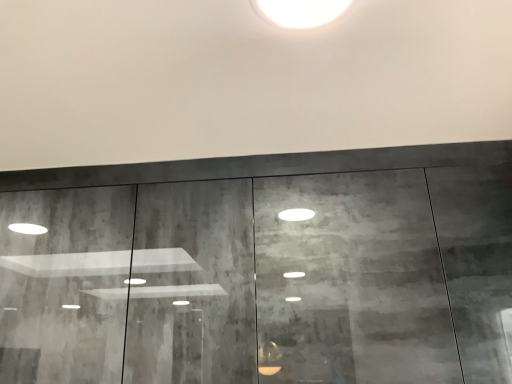
Describe the element at coordinates (273, 167) in the screenshot. I see `textured concrete door at center` at that location.

Locate an element on the screen. The image size is (512, 384). textured concrete door at center is located at coordinates point(273,167).

This screenshot has width=512, height=384. What are the coordinates of `white glossy light at upper center` in the screenshot? It's located at (302, 11).

What do you see at coordinates (302, 11) in the screenshot? I see `white glossy light at upper center` at bounding box center [302, 11].

Find the location of a particular element. Image resolution: width=512 pixels, height=384 pixels. textured concrete door at center is located at coordinates (273, 167).

Which object is positioned more to the left, textured concrete door at center or white glossy light at upper center?

textured concrete door at center is more to the left.

Considering the relative positions of textured concrete door at center and white glossy light at upper center in the image provided, is textured concrete door at center in front of white glossy light at upper center?

No, it is not.

Which is further, (426, 151) or (279, 20)?

A: The point (426, 151) is farther from the camera.

From the image's perspective, who appears lower, textured concrete door at center or white glossy light at upper center?

From the image's view, textured concrete door at center is below.

From a real-world perspective, is textured concrete door at center physically located above or below white glossy light at upper center?

In terms of real-world spatial position, textured concrete door at center is below white glossy light at upper center.

Is textured concrete door at center wider or thinner than white glossy light at upper center?

In the image, textured concrete door at center appears to be wider than white glossy light at upper center.

Can you confirm if textured concrete door at center is shorter than white glossy light at upper center?

No.

Between textured concrete door at center and white glossy light at upper center, which one has larger size?

textured concrete door at center is bigger.

Can we say textured concrete door at center lies outside white glossy light at upper center?

Absolutely, textured concrete door at center is external to white glossy light at upper center.

Would you say textured concrete door at center is a long distance from white glossy light at upper center?

No, there isn't a large distance between textured concrete door at center and white glossy light at upper center.

Could you tell me if textured concrete door at center is turned towards white glossy light at upper center?

Yes, textured concrete door at center is turned towards white glossy light at upper center.

What's the angular difference between textured concrete door at center and white glossy light at upper center's facing directions?

The angle between the facing direction of textured concrete door at center and the facing direction of white glossy light at upper center is 0.0137 degrees.

Measure the distance from textured concrete door at center to white glossy light at upper center.

textured concrete door at center and white glossy light at upper center are 28.42 inches apart.

In the image, there is a textured concrete door at center. Where is `light above it (from the image's perspective)`? light above it (from the image's perspective) is located at coordinates (302, 11).

Considering the relative positions of white glossy light at upper center and textured concrete door at center in the image provided, is white glossy light at upper center to the left of textured concrete door at center from the viewer's perspective?

No.

Relative to textured concrete door at center, is white glossy light at upper center in front or behind?

In the image, white glossy light at upper center appears in front of textured concrete door at center.

Does point (323, 4) lie behind point (449, 155)?

That is False.

From the image's perspective, is white glossy light at upper center above textured concrete door at center?

Yes, from the image's perspective, white glossy light at upper center is above textured concrete door at center.

Consider the image. From a real-world perspective, is white glossy light at upper center physically located above or below textured concrete door at center?

In terms of real-world spatial position, white glossy light at upper center is above textured concrete door at center.

Which of these two, white glossy light at upper center or textured concrete door at center, is wider?

textured concrete door at center is wider.

Between white glossy light at upper center and textured concrete door at center, which one has less height?

white glossy light at upper center is shorter.

Does white glossy light at upper center have a larger size compared to textured concrete door at center?

No, white glossy light at upper center is not bigger than textured concrete door at center.

Is white glossy light at upper center inside or outside of textured concrete door at center?

white glossy light at upper center cannot be found inside textured concrete door at center.

Does white glossy light at upper center touch textured concrete door at center?

No, white glossy light at upper center is not in contact with textured concrete door at center.

Is white glossy light at upper center positioned with its back to textured concrete door at center?

No, white glossy light at upper center is not facing the opposite direction of textured concrete door at center.

Where is `light that appears above the textured concrete door at center (from a real-world perspective)`? light that appears above the textured concrete door at center (from a real-world perspective) is located at coordinates tap(302, 11).

This screenshot has width=512, height=384. I want to click on door below the white glossy light at upper center (from the image's perspective), so click(273, 167).

This screenshot has height=384, width=512. What are the coordinates of `light that appears above the textured concrete door at center (from a real-world perspective)` in the screenshot? It's located at (302, 11).